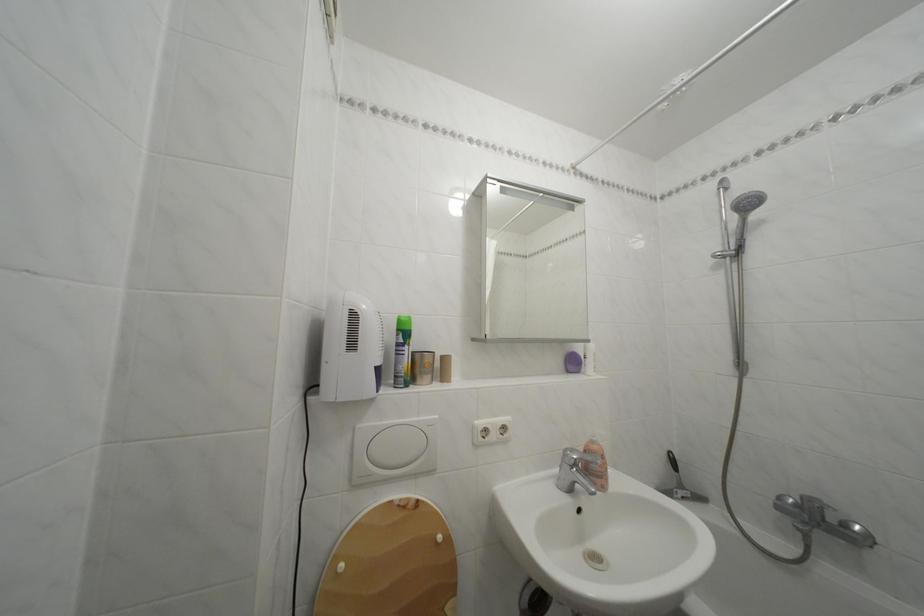
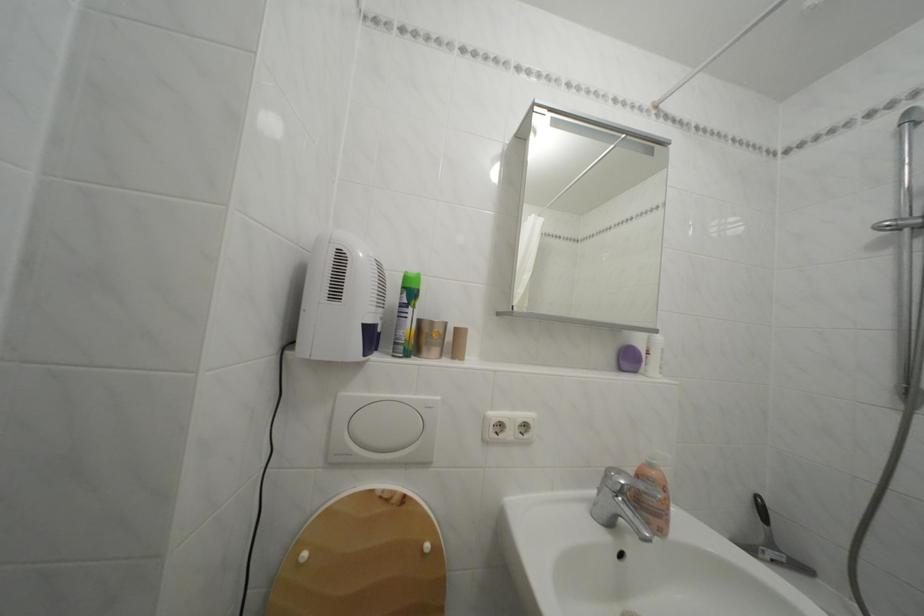
Question: Which direction would the cameraman need to move to produce the second image? Reply with the corresponding letter.

Choices:
 (A) Left
 (B) Right
 (C) Forward
 (D) Backward

Answer: (C)